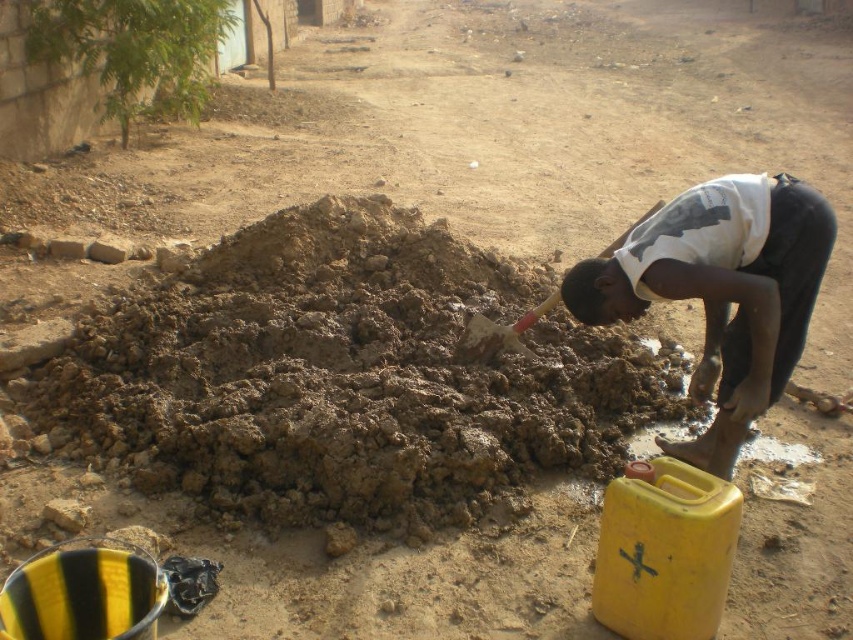
Is dark gray concrete squat at lower right closer to camera compared to wooden handle shovel at center?

Yes, it is.

Which of these two, dark gray concrete squat at lower right or wooden handle shovel at center, stands taller?

dark gray concrete squat at lower right is taller.

What do you see at coordinates (720, 291) in the screenshot? I see `dark gray concrete squat at lower right` at bounding box center [720, 291].

At what (x,y) coordinates should I click in order to perform the action: click on dark gray concrete squat at lower right. Please return your answer as a coordinate pair (x, y). The image size is (853, 640). Looking at the image, I should click on tap(720, 291).

Does brown clay mound at center lie behind dark gray concrete squat at lower right?

Yes, brown clay mound at center is further from the viewer.

Does brown clay mound at center have a lesser width compared to dark gray concrete squat at lower right?

In fact, brown clay mound at center might be wider than dark gray concrete squat at lower right.

Identify the location of brown clay mound at center. The height and width of the screenshot is (640, 853). (340, 376).

Is brown clay mound at center below wooden handle shovel at center?

Yes, brown clay mound at center is below wooden handle shovel at center.

Describe the element at coordinates (340, 376) in the screenshot. I see `brown clay mound at center` at that location.

I want to click on brown clay mound at center, so click(x=340, y=376).